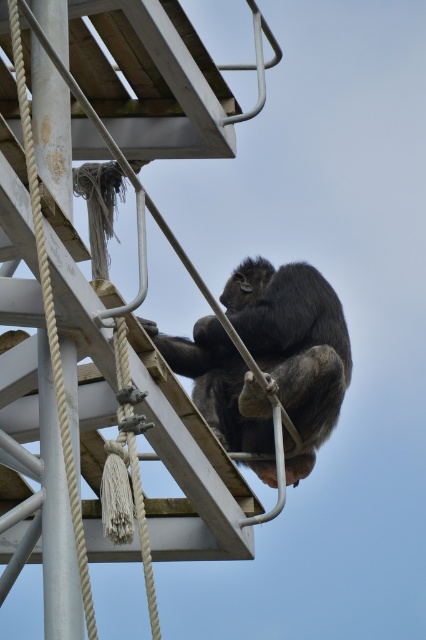
You are a zookeeper observing the chimpanzee enclosure. You notice the shiny black monkey at center and the white rope at left. Which object is taller in the image?

The white rope at left is taller than the shiny black monkey at center.

You are a zookeeper observing the chimpanzee enclosure. You notice the shiny black monkey at center and the white rope at left. Based on their positions, which object is closer to the left side of the enclosure?

The white rope at left is closer to the left side of the enclosure because the shiny black monkey at center is positioned on the right side of it.